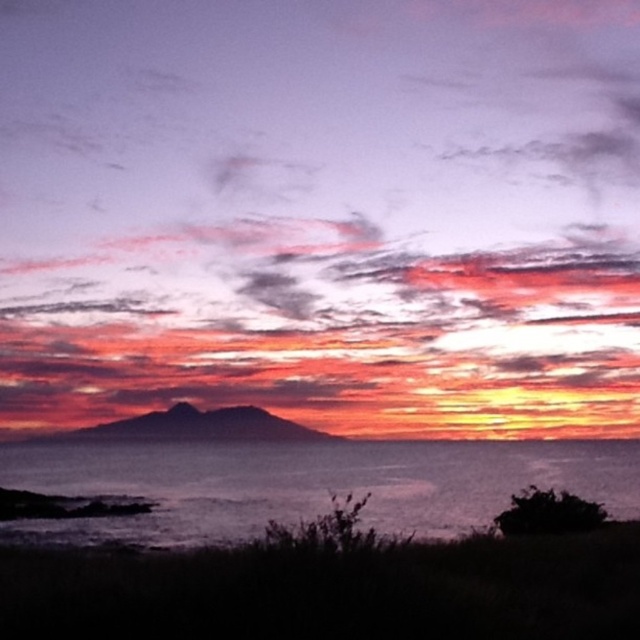
Is matte pink cloud at center wider than dark blue water at lower center?

Yes, matte pink cloud at center is wider than dark blue water at lower center.

Is point (579, 156) closer to camera compared to point (132, 472)?

No, it is not.

Does point (259, 324) come farther from viewer compared to point (173, 458)?

Yes, point (259, 324) is behind point (173, 458).

The image size is (640, 640). In order to click on matte pink cloud at center in this screenshot , I will do (x=321, y=214).